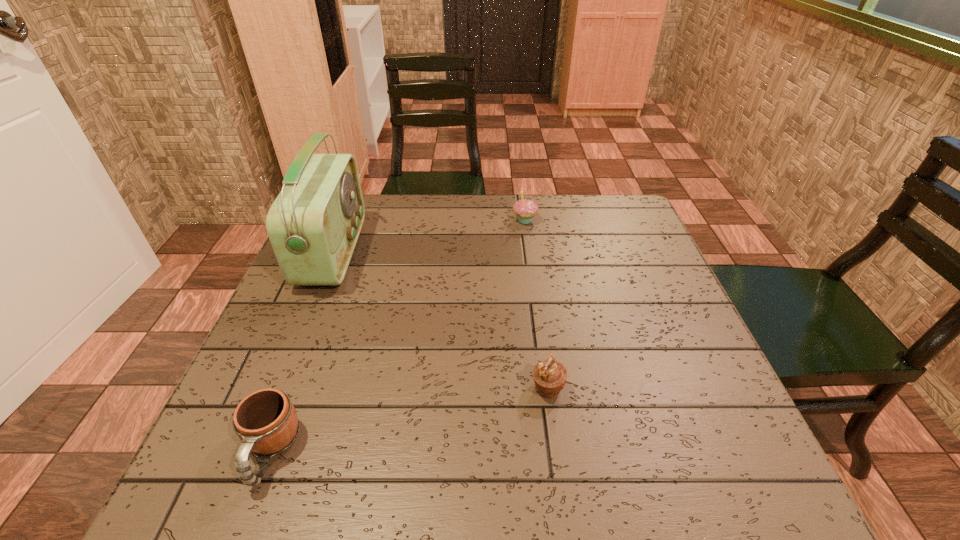
Find the location of a particular element. radio receiver that is at the left edge is located at coordinates (313, 225).

Where is `mug present at the left edge`? mug present at the left edge is located at coordinates (266, 422).

I want to click on object at the far left corner, so click(x=313, y=225).

Where is `object at the near left corner`? The width and height of the screenshot is (960, 540). object at the near left corner is located at coordinates (266, 422).

Where is `blank space at the far edge of the desktop`? This screenshot has width=960, height=540. blank space at the far edge of the desktop is located at coordinates (569, 216).

Where is `blank space at the near edge`? blank space at the near edge is located at coordinates (351, 454).

Image resolution: width=960 pixels, height=540 pixels. Identify the location of free space at the left edge of the desktop. (239, 399).

Identify the location of vacant space at the right edge of the desktop. Image resolution: width=960 pixels, height=540 pixels. (678, 444).

This screenshot has height=540, width=960. In order to click on vacant region at the far right corner in this screenshot , I will do `click(621, 203)`.

Find the location of a particular element. Image resolution: width=960 pixels, height=540 pixels. free space between the cupcake and the mug is located at coordinates (397, 335).